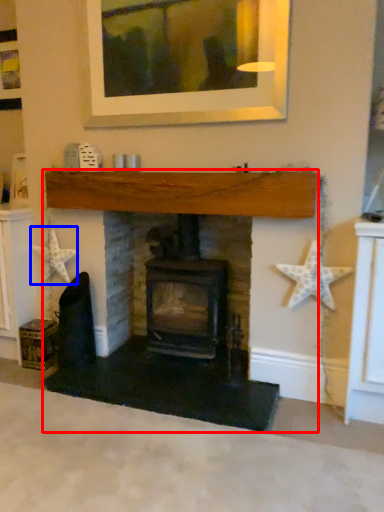
Question: Among these objects, which one is farthest to the camera, fireplace (highlighted by a red box) or starfish (highlighted by a blue box)?

Choices:
 (A) fireplace
 (B) starfish

Answer: (B)